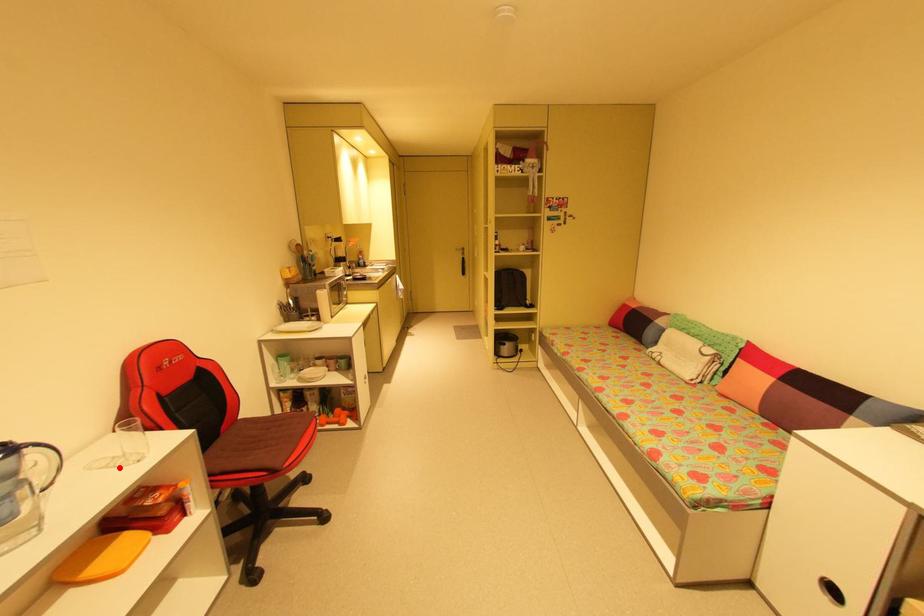
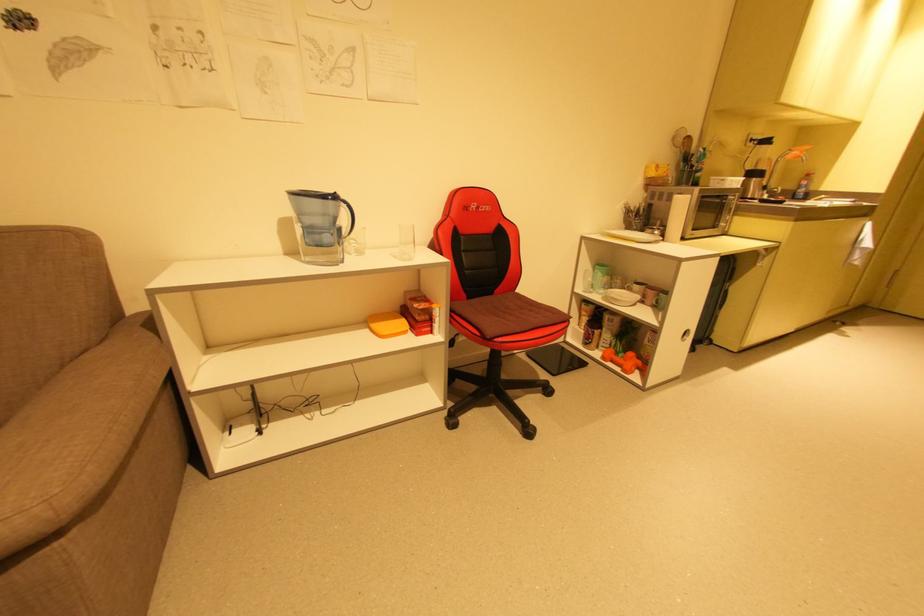
Question: I am providing you with two images of the same scene from different viewpoints. A red point is shown in image1. For the corresponding object point in image2, is it positioned nearer or farther from the camera?

Choices:
 (A) Nearer
 (B) Farther

Answer: (A)